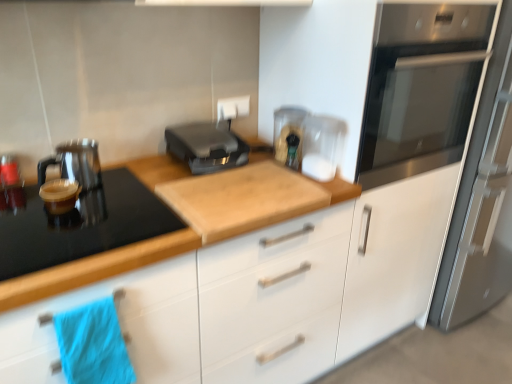
This screenshot has width=512, height=384. I want to click on free space above wooden cutting board at center (from a real-world perspective), so click(170, 188).